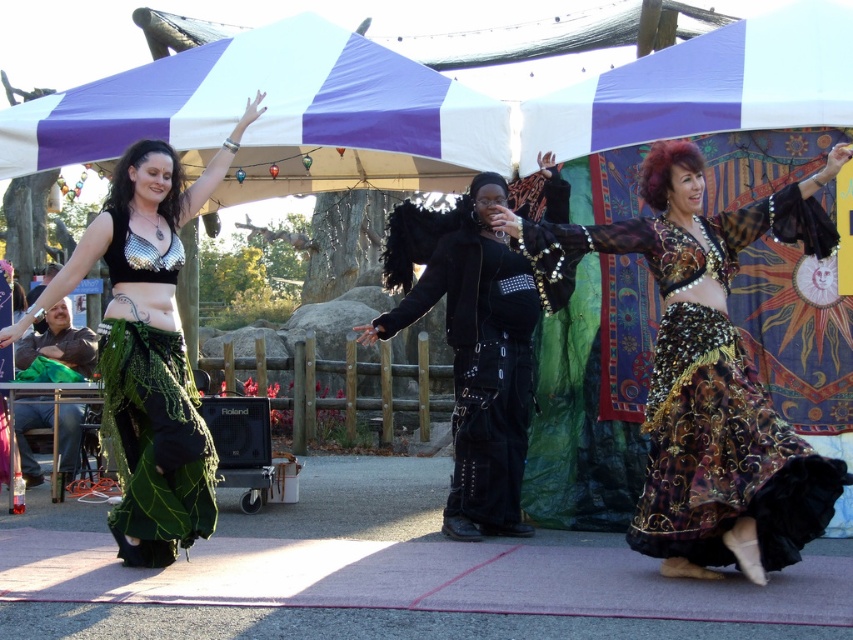
Question: Does black leather outfit at center have a smaller size compared to metallic mesh bikini top at center?

Choices:
 (A) no
 (B) yes

Answer: (A)

Question: Which object is the closest to the metallic sequined top at center?

Choices:
 (A) black leather outfit at center
 (B) metallic mesh bikini top at center
 (C) gold sequined skirt at center

Answer: (B)

Question: Can you confirm if gold sequined skirt at center is bigger than black leather outfit at center?

Choices:
 (A) yes
 (B) no

Answer: (A)

Question: Which point is closer to the camera?

Choices:
 (A) metallic sequined top at center
 (B) gold sequined skirt at center
 (C) metallic mesh bikini top at center

Answer: (B)

Question: Is the position of gold sequined skirt at center less distant than that of black leather outfit at center?

Choices:
 (A) no
 (B) yes

Answer: (B)

Question: Which object is the closest to the gold sequined skirt at center?

Choices:
 (A) metallic sequined top at center
 (B) black leather outfit at center

Answer: (B)